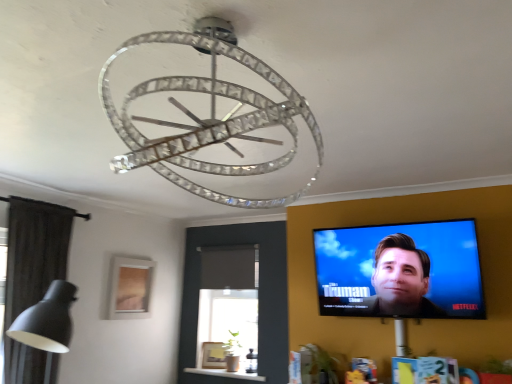
Question: Considering the relative sizes of clear crystal chandelier at center and matte black tv at upper right in the image provided, is clear crystal chandelier at center bigger than matte black tv at upper right?

Choices:
 (A) yes
 (B) no

Answer: (B)

Question: Is clear crystal chandelier at center wider than matte black tv at upper right?

Choices:
 (A) no
 (B) yes

Answer: (B)

Question: Is clear crystal chandelier at center next to matte black tv at upper right and touching it?

Choices:
 (A) no
 (B) yes

Answer: (A)

Question: Is clear crystal chandelier at center to the right of matte black tv at upper right from the viewer's perspective?

Choices:
 (A) yes
 (B) no

Answer: (B)

Question: Could you tell me if clear crystal chandelier at center is facing matte black tv at upper right?

Choices:
 (A) no
 (B) yes

Answer: (A)

Question: Considering the relative positions of clear crystal chandelier at center and matte black tv at upper right in the image provided, is clear crystal chandelier at center to the left of matte black tv at upper right from the viewer's perspective?

Choices:
 (A) yes
 (B) no

Answer: (A)

Question: Does matte wooden picture frame at lower left have a greater width compared to clear crystal chandelier at center?

Choices:
 (A) no
 (B) yes

Answer: (A)

Question: Is matte wooden picture frame at lower left positioned beyond the bounds of clear crystal chandelier at center?

Choices:
 (A) yes
 (B) no

Answer: (A)

Question: Can you confirm if matte wooden picture frame at lower left is thinner than clear crystal chandelier at center?

Choices:
 (A) yes
 (B) no

Answer: (A)

Question: Is matte wooden picture frame at lower left to the left of clear crystal chandelier at center from the viewer's perspective?

Choices:
 (A) no
 (B) yes

Answer: (B)

Question: From the image's perspective, is matte wooden picture frame at lower left over clear crystal chandelier at center?

Choices:
 (A) yes
 (B) no

Answer: (B)

Question: Can you confirm if matte wooden picture frame at lower left is shorter than clear crystal chandelier at center?

Choices:
 (A) no
 (B) yes

Answer: (A)

Question: Is matte black tv at upper right at the left side of matte wooden picture frame at lower left?

Choices:
 (A) yes
 (B) no

Answer: (B)